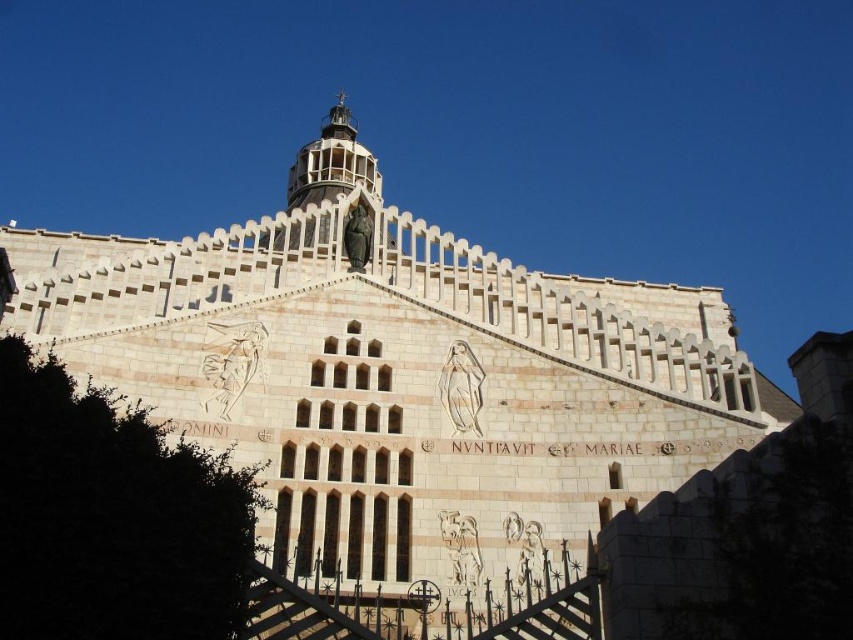
Looking at this image, is dark green leafy tree at lower left positioned at the back of white lattice tower at upper center?

No, it is in front of white lattice tower at upper center.

Is dark green leafy tree at lower left smaller than white lattice tower at upper center?

Yes.

Which is in front, point (26, 630) or point (322, 198)?

Point (26, 630) is more forward.

Locate an element on the screen. dark green leafy tree at lower left is located at coordinates (112, 516).